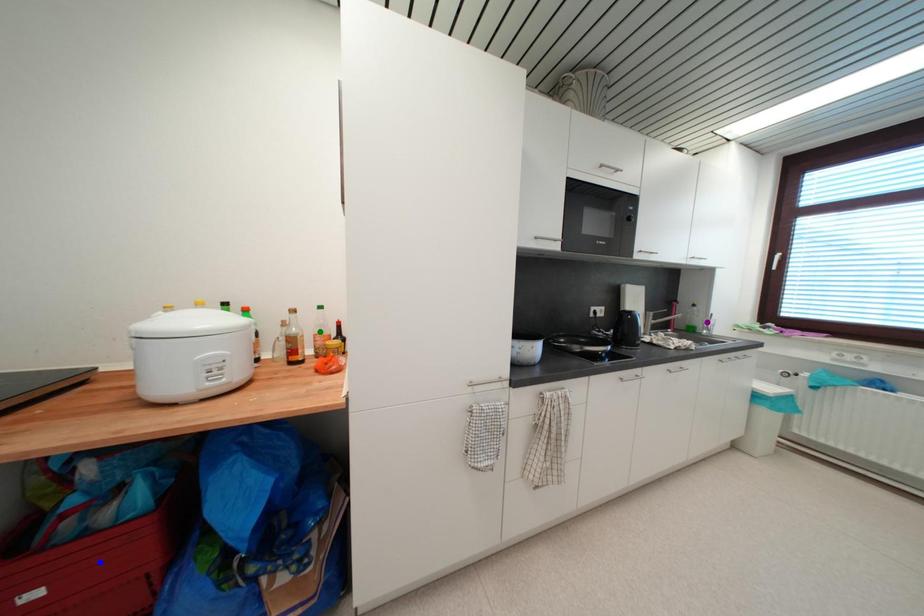
Order these from nearest to farthest:
purple point | blue point | green point

blue point
green point
purple point